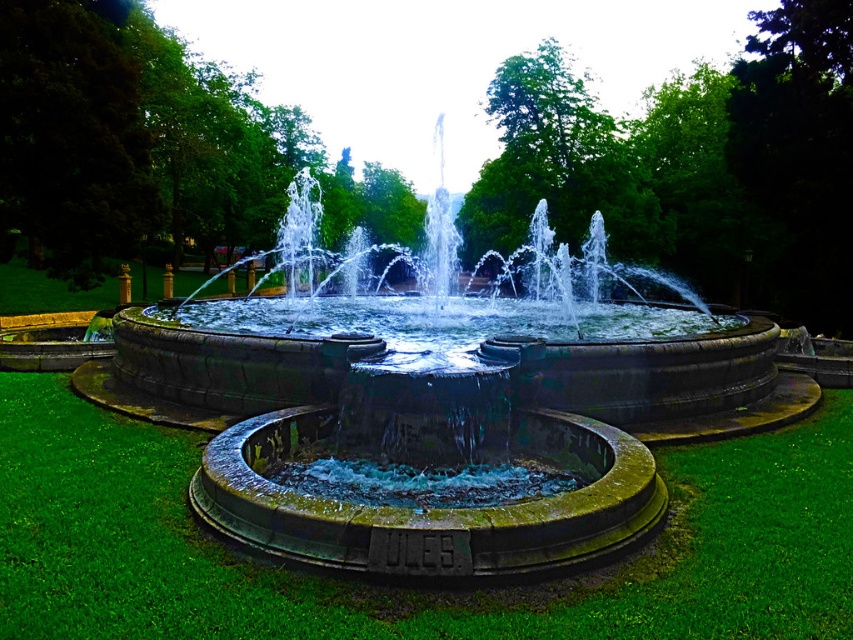
Find the location of a particular element. The image size is (853, 640). green stone fountain at center is located at coordinates (440, 406).

The width and height of the screenshot is (853, 640). What do you see at coordinates (440, 406) in the screenshot?
I see `green stone fountain at center` at bounding box center [440, 406].

Where is `green stone fountain at center`? green stone fountain at center is located at coordinates (440, 406).